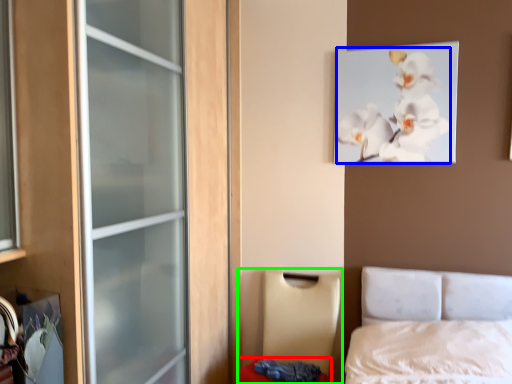
Question: Which object is the farthest from mattress (highlighted by a red box)? Choose among these: flower (highlighted by a blue box) or furniture (highlighted by a green box).

Choices:
 (A) flower
 (B) furniture

Answer: (A)